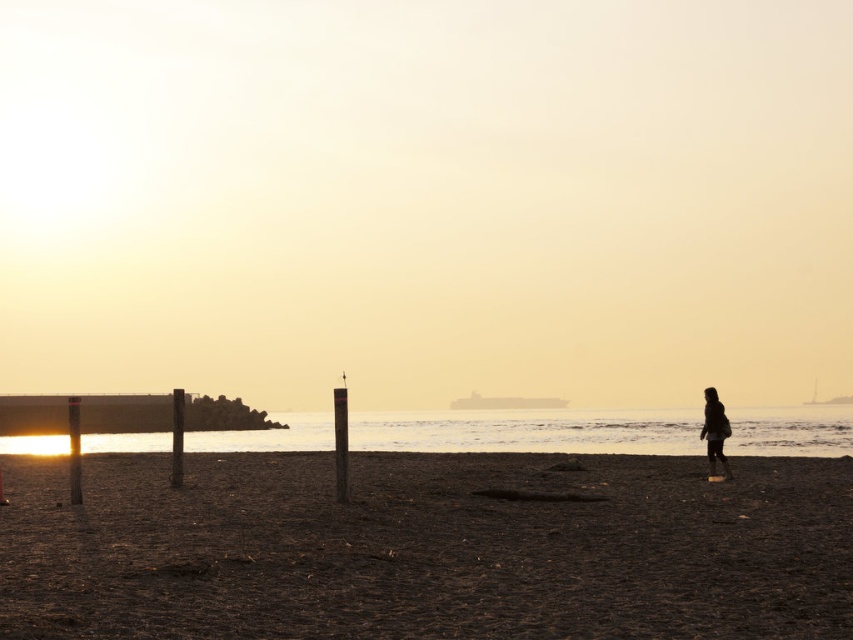
Question: Is dark sand at lower center above dark textured coat at right?

Choices:
 (A) yes
 (B) no

Answer: (B)

Question: Does dark sand at lower center appear under dark textured coat at right?

Choices:
 (A) yes
 (B) no

Answer: (A)

Question: Is the position of dark sand at lower center less distant than that of dark textured coat at right?

Choices:
 (A) no
 (B) yes

Answer: (B)

Question: Which point is closer to the camera taking this photo?

Choices:
 (A) (674, 458)
 (B) (717, 416)

Answer: (B)

Question: Which point is farther to the camera?

Choices:
 (A) (721, 428)
 (B) (827, 580)

Answer: (A)